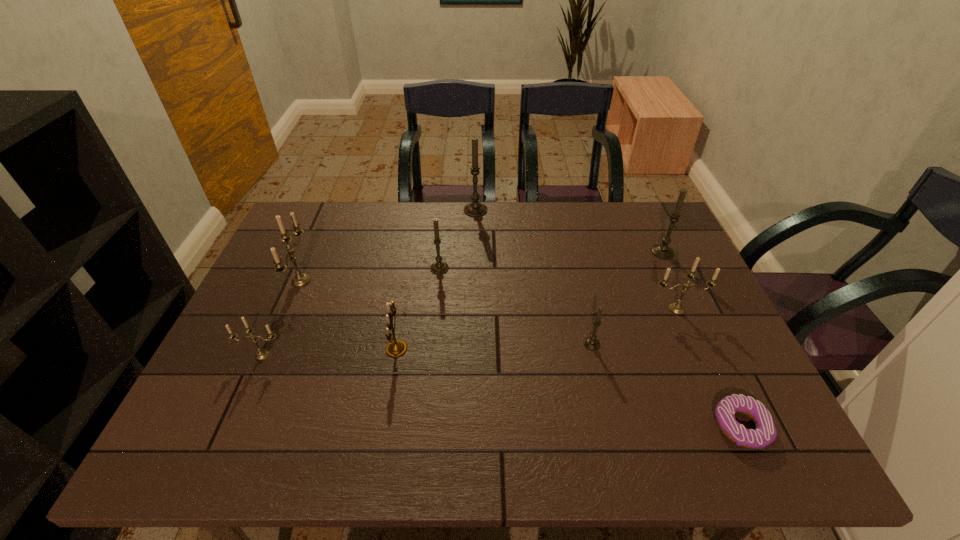
The height and width of the screenshot is (540, 960). What are the coordinates of `the smallest gray candle` in the screenshot? It's located at (591, 343).

This screenshot has height=540, width=960. Find the location of `the sixth object from left to right`. the sixth object from left to right is located at coordinates (591, 343).

At what (x,y) coordinates should I click in order to perform the action: click on the smallest metallic candle. Please return your answer as a coordinate pair (x, y). The image size is (960, 540). Looking at the image, I should click on (261, 354).

Where is `the shortest object`? the shortest object is located at coordinates (765, 433).

Identify the location of the nearest object. The image size is (960, 540). (765, 433).

Locate an element on the screen. This screenshot has height=540, width=960. vacant space located 0.050m on the left of the farthest gray candle is located at coordinates (449, 210).

In order to click on free spot located on the front of the biggest metallic candle in this screenshot , I will do `click(270, 355)`.

Locate an element on the screen. Image resolution: width=960 pixels, height=540 pixels. vacant area located on the left of the sixth nearest candle is located at coordinates (612, 252).

Locate an element on the screen. The height and width of the screenshot is (540, 960). vacant area located on the front of the second smallest gray candle is located at coordinates point(436,305).

Locate an element on the screen. This screenshot has height=540, width=960. vacant area situated 0.350m on the back of the second biggest metallic candle is located at coordinates (640, 226).